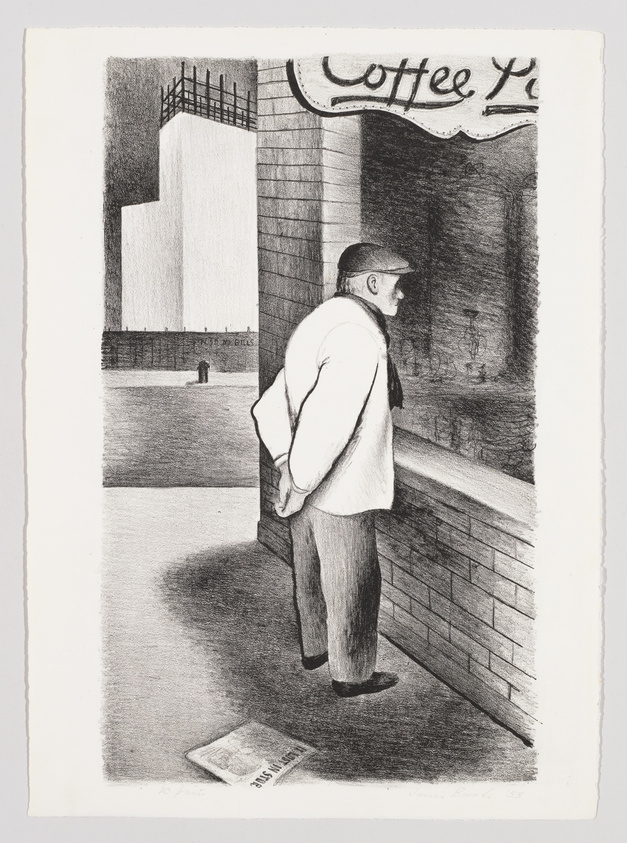
I want to click on dark shadow inside window, so click(469, 310).